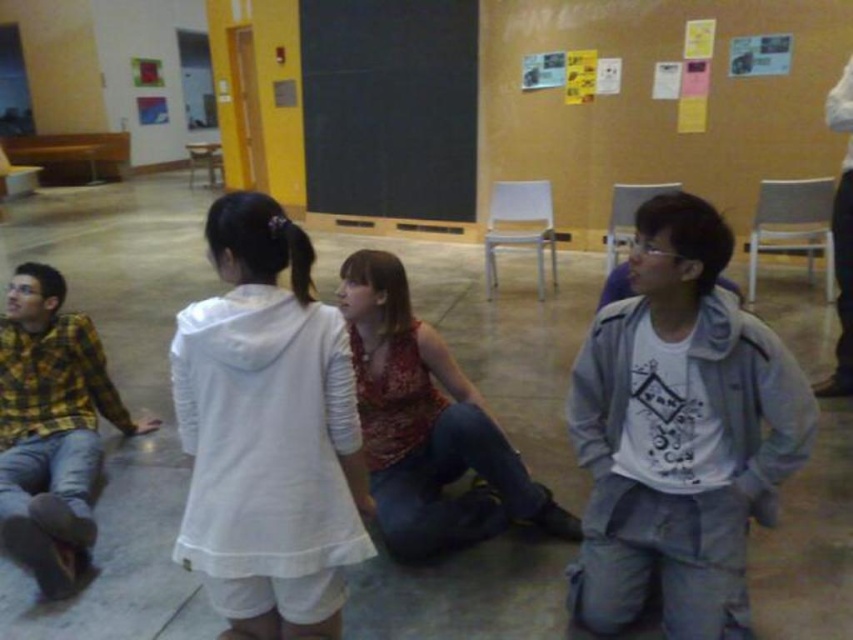
Question: Does gray matte jacket at right have a greater width compared to yellow plaid shirt at left?

Choices:
 (A) yes
 (B) no

Answer: (A)

Question: Where is gray matte jacket at right located in relation to black chalkboard at center in the image?

Choices:
 (A) below
 (B) above

Answer: (A)

Question: Estimate the real-world distances between objects in this image. Which object is farther from the printed fabric tank top at center?

Choices:
 (A) gray matte jacket at right
 (B) yellow plaid shirt at left

Answer: (B)

Question: Based on their relative distances, which object is nearer to the white cotton hoodie at center?

Choices:
 (A) black chalkboard at center
 (B) gray matte jacket at right
 (C) yellow plaid shirt at left

Answer: (B)

Question: Which of these objects is positioned farthest from the yellow plaid shirt at left?

Choices:
 (A) white cotton hoodie at center
 (B) printed fabric tank top at center
 (C) black chalkboard at center

Answer: (C)

Question: Is gray matte jacket at right above white cotton hoodie at center?

Choices:
 (A) yes
 (B) no

Answer: (A)